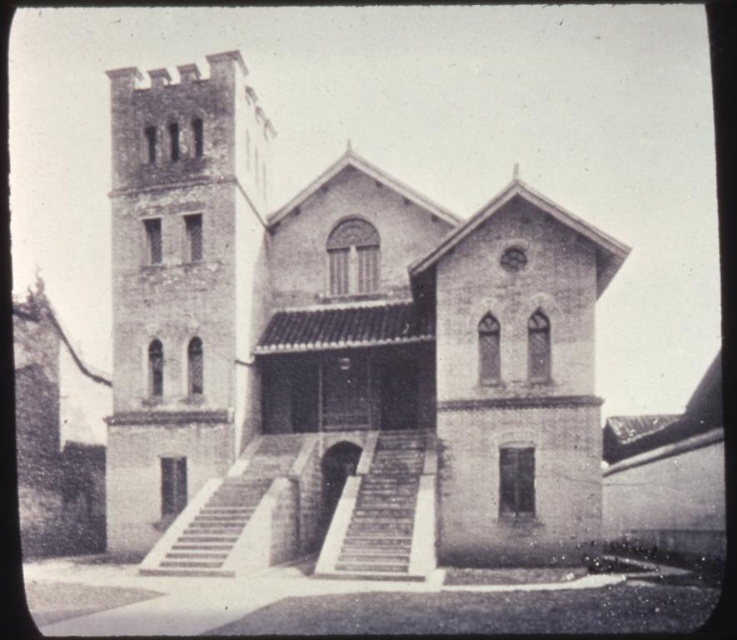
Question: Which object appears closest to the camera in this image?

Choices:
 (A) stone textured stairs at center
 (B) brick tower at left
 (C) smooth concrete stairs at center
 (D) brick chapel at center

Answer: (A)

Question: Which of the following is the closest to the observer?

Choices:
 (A) (312, 364)
 (B) (247, 497)

Answer: (B)

Question: Is the position of brick chapel at center more distant than that of stone textured stairs at center?

Choices:
 (A) yes
 (B) no

Answer: (A)

Question: Estimate the real-world distances between objects in this image. Which object is closer to the stone textured stairs at center?

Choices:
 (A) brick tower at left
 (B) smooth concrete stairs at center
 (C) brick chapel at center

Answer: (B)

Question: Does brick tower at left have a smaller size compared to smooth concrete stairs at center?

Choices:
 (A) yes
 (B) no

Answer: (B)

Question: Does brick tower at left come in front of smooth concrete stairs at center?

Choices:
 (A) yes
 (B) no

Answer: (B)